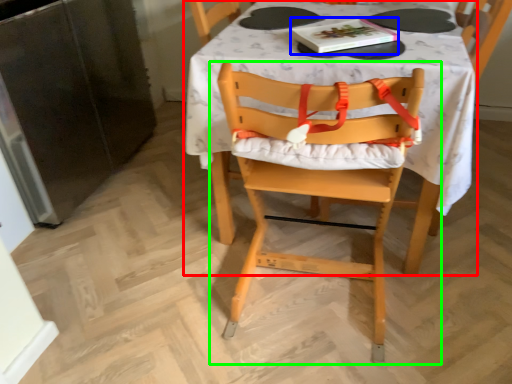
Question: Considering the real-world distances, which object is farthest from table (highlighted by a red box)? book (highlighted by a blue box) or chair (highlighted by a green box)?

Choices:
 (A) book
 (B) chair

Answer: (A)